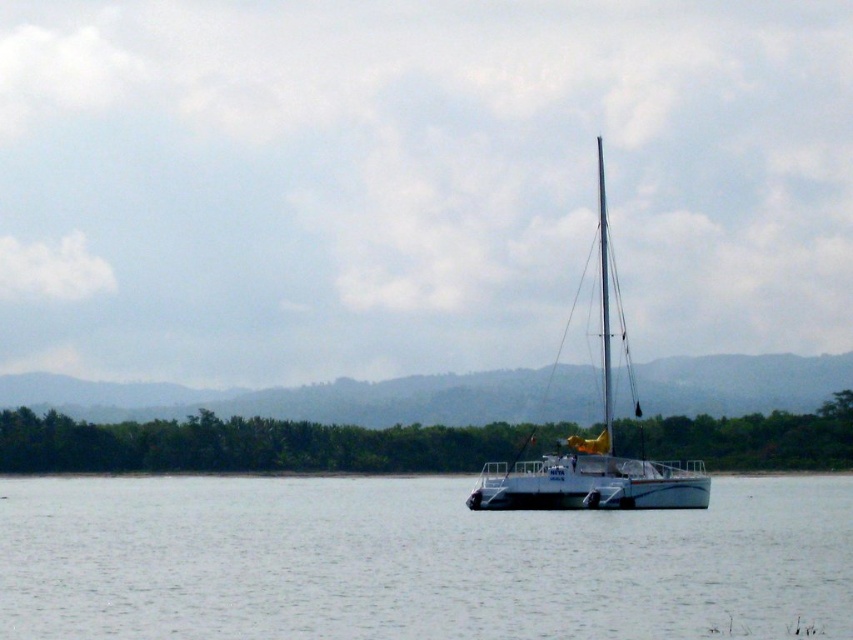
Is clear water at center to the right of white matte sailboat at center from the viewer's perspective?

In fact, clear water at center is to the left of white matte sailboat at center.

Who is more distant from viewer, (709, 545) or (630, 388)?

The point (630, 388) is behind.

At what (x,y) coordinates should I click in order to perform the action: click on clear water at center. Please return your answer as a coordinate pair (x, y). Image resolution: width=853 pixels, height=640 pixels. Looking at the image, I should click on (415, 561).

Identify the location of clear water at center. (415, 561).